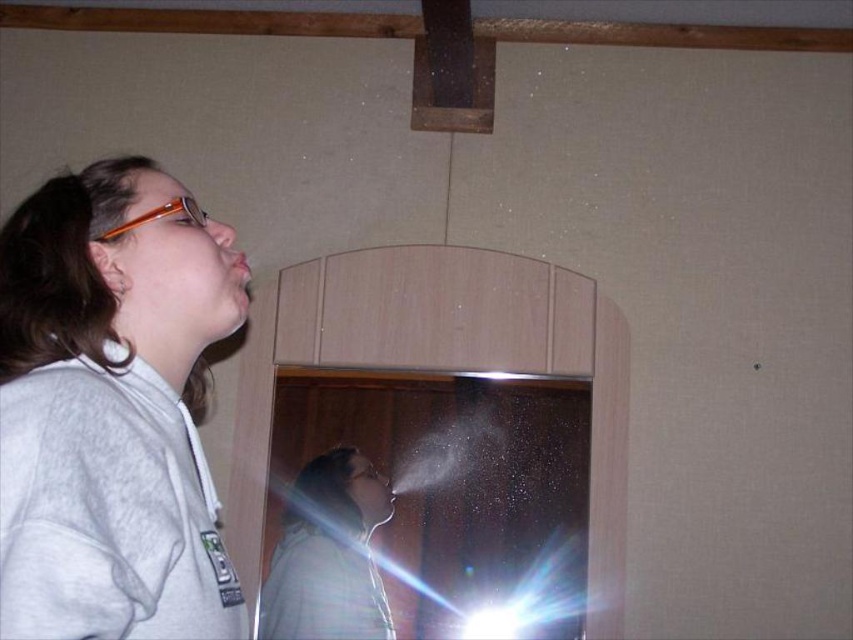
Question: Which of the following is the closest to the observer?

Choices:
 (A) (160, 228)
 (B) (341, 636)

Answer: (A)

Question: Can you confirm if gray fleece jacket at upper left is positioned below matte gray shirt at center?

Choices:
 (A) yes
 (B) no

Answer: (B)

Question: Observing the image, what is the correct spatial positioning of gray fleece jacket at upper left in reference to matte gray shirt at center?

Choices:
 (A) above
 (B) below

Answer: (A)

Question: Can you confirm if gray fleece jacket at upper left is positioned below matte gray shirt at center?

Choices:
 (A) yes
 (B) no

Answer: (B)

Question: Which point appears closest to the camera in this image?

Choices:
 (A) (3, 412)
 (B) (300, 570)

Answer: (A)